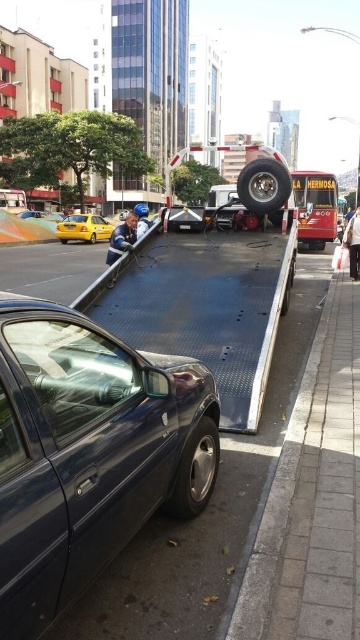
Question: Does matte dark blue sedan at center have a smaller size compared to yellow matte taxi at left?

Choices:
 (A) no
 (B) yes

Answer: (B)

Question: Considering the relative positions of matte dark blue sedan at center and metallic flatbed at center in the image provided, where is matte dark blue sedan at center located with respect to metallic flatbed at center?

Choices:
 (A) below
 (B) above

Answer: (A)

Question: Which of these objects is positioned farthest from the matte dark blue sedan at center?

Choices:
 (A) metallic flatbed at center
 (B) yellow matte taxi at left

Answer: (B)

Question: Which object is farther from the camera taking this photo?

Choices:
 (A) matte dark blue sedan at center
 (B) metallic flatbed at center
 (C) yellow matte taxi at left

Answer: (C)

Question: Can you confirm if matte dark blue sedan at center is bigger than metallic flatbed at center?

Choices:
 (A) yes
 (B) no

Answer: (B)

Question: Based on their relative distances, which object is farther from the yellow matte taxi at left?

Choices:
 (A) matte dark blue sedan at center
 (B) metallic flatbed at center

Answer: (A)